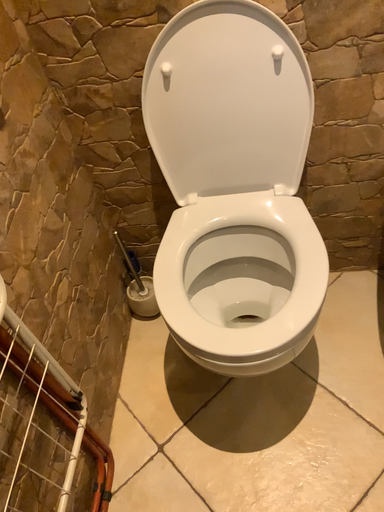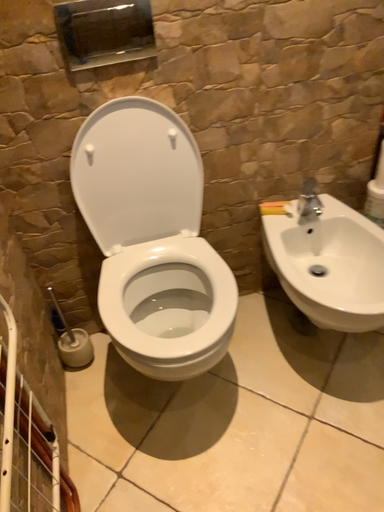
Question: Which way did the camera rotate in the video?

Choices:
 (A) rotated left
 (B) rotated right

Answer: (B)